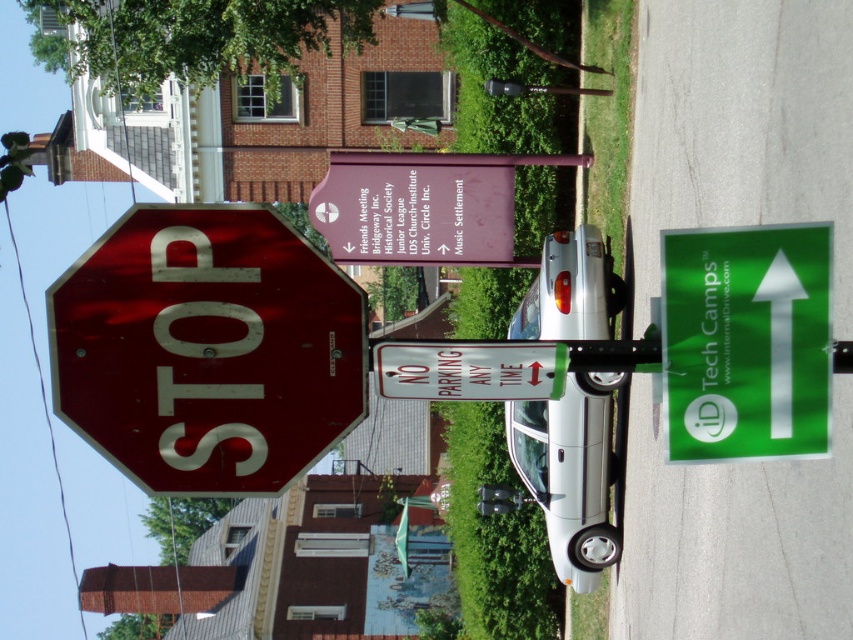
You are a delivery driver who needs to attach a sticker to the narrowest object between the green glossy arrow at upper right and the white plastic sign at center. Which object should you choose?

The white plastic sign at center is narrower, so you should attach the sticker to the white plastic sign at center because the green glossy arrow at upper right is wider than the white plastic sign at center according to the description.

You are a delivery driver who needs to read the directions on the white plastic sign at center. Can you see it clearly from your current position, considering the green glossy arrow at upper right is blocking your view?

The green glossy arrow at upper right is larger in size than the white plastic sign at center, so it might block your view of the white plastic sign at center. You may need to move to a different angle to see it better.

In the scene shown: You are a pedestrian standing at the street corner and see the shiny red stop sign at left and the green glossy arrow at upper right. Which object is located more to the left?

The shiny red stop sign at left is more to the left than the green glossy arrow at upper right.